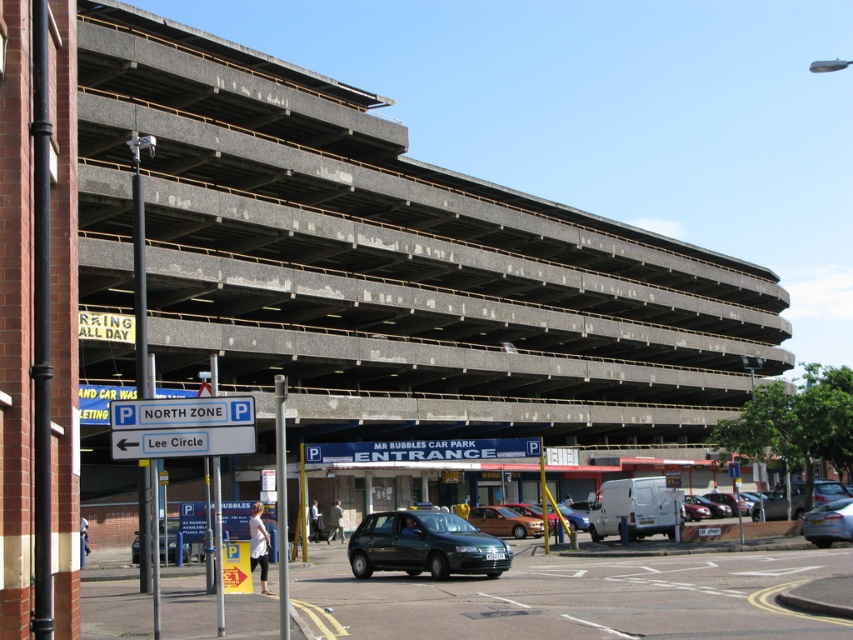
Question: Can you confirm if matte black hatchback at center is positioned below metallic gray hatchback at lower left?

Choices:
 (A) no
 (B) yes

Answer: (A)

Question: Which point is closer to the camera?

Choices:
 (A) silver metallic sedan at lower right
 (B) metallic gray hatchback at lower left
 (C) matte brown car at center

Answer: (A)

Question: Which point is closer to the camera?

Choices:
 (A) metallic gray hatchback at lower left
 (B) dark gray concrete parking garage at center
 (C) matte brown car at center

Answer: (A)

Question: Is silver metallic sedan at lower right wider than matte brown car at center?

Choices:
 (A) yes
 (B) no

Answer: (A)

Question: Where is blue plastic sign at lower left located in relation to silver metallic sedan at lower right in the image?

Choices:
 (A) above
 (B) below

Answer: (A)

Question: Which point is farther to the camera?

Choices:
 (A) (389, 518)
 (B) (482, 522)
 (C) (206, 442)
 (D) (163, 557)

Answer: (B)